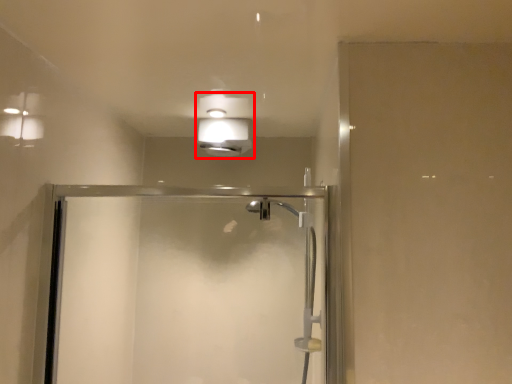
Question: Where is light fixture (annotated by the red box) located in relation to screen door in the image?

Choices:
 (A) right
 (B) left

Answer: (A)